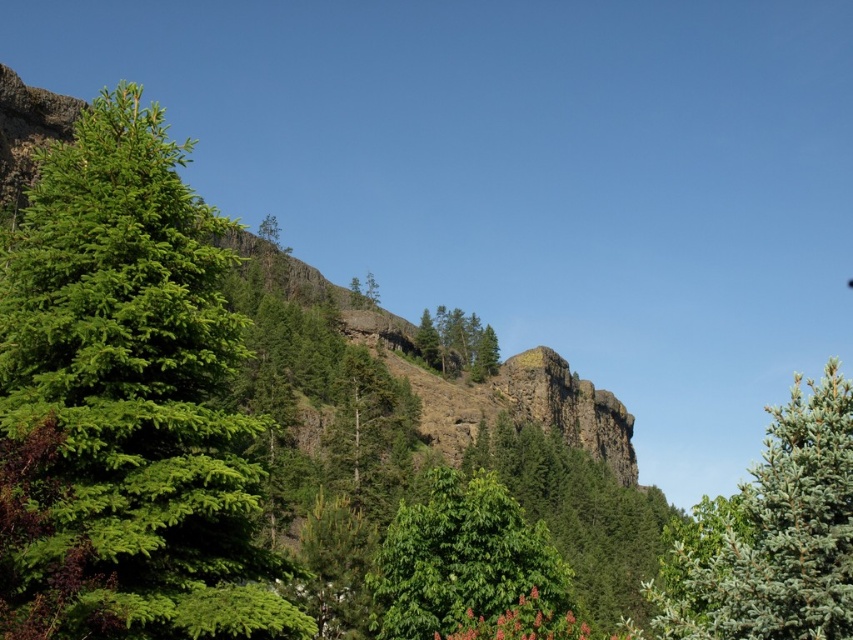
Can you confirm if brown rocky mountain at center is wider than green matte tree at upper center?

Correct, the width of brown rocky mountain at center exceeds that of green matte tree at upper center.

Who is shorter, brown rocky mountain at center or green matte tree at upper center?

green matte tree at upper center

Who is more distant from viewer, (527,419) or (448,364)?

The point (448,364) is more distant.

Locate an element on the screen. brown rocky mountain at center is located at coordinates (465, 376).

Is point (685, 612) farther from viewer compared to point (473, 602)?

That is False.

Is point (772, 605) positioned after point (461, 625)?

No, it is in front of (461, 625).

Identify the location of green matte tree at right. (773, 534).

Can you confirm if green matte tree at right is wider than green matte tree at upper center?

In fact, green matte tree at right might be narrower than green matte tree at upper center.

Which is more to the left, green matte tree at right or green matte tree at upper center?

green matte tree at upper center

Is point (822, 465) farther from viewer compared to point (463, 323)?

No.

Locate an element on the screen. The width and height of the screenshot is (853, 640). green matte tree at right is located at coordinates (773, 534).